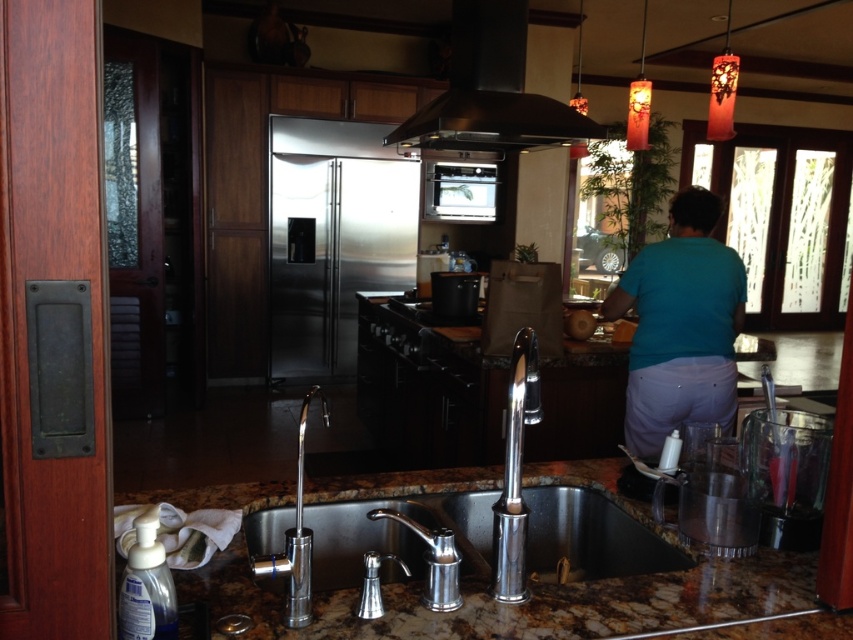
Looking at this image, you are a delivery person who just arrived at the house. You need to place a package on the counter between the stainless steel refrigerator at center and the blue cotton shirt at center. The package is 3.5 meters long. Will the package fit between them?

The distance between the stainless steel refrigerator at center and the blue cotton shirt at center is 3.49 meters. Since the package is 3.5 meters long, it will not fit between them as it is slightly longer than the available space.

You are a delivery person trying to deliver a new microwave to the kitchen. The delivery requires placing it in the exact spot where the stainless steel refrigerator at center is currently located. Can you move the refrigerator to the right side of the kitchen to make space? Please explain your reasoning based on the kitchen layout described.

The stainless steel refrigerator at center is positioned at point (334, 237). Without additional information about the kitchen layout, such as the location of walls or other appliances, it is impossible to determine if moving the refrigerator to the right side would be feasible. The exact coordinates alone do not provide enough context about available space or obstacles.